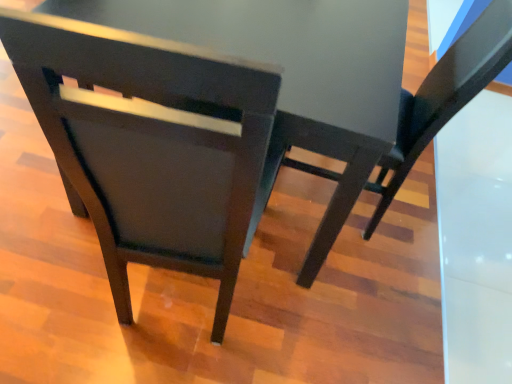
Question: Is matte black chair at center, which is the 2th chair from right to left, to the left or to the right of matte black chair at center, acting as the first chair starting from the right, in the image?

Choices:
 (A) right
 (B) left

Answer: (B)

Question: From the image's perspective, is matte black chair at center, which is the 2th chair from right to left, located above or below matte black chair at center, positioned as the second chair in left-to-right order?

Choices:
 (A) below
 (B) above

Answer: (A)

Question: Considering the positions of matte black chair at center, which is the 2th chair from right to left, and matte black chair at center, acting as the first chair starting from the right, in the image, is matte black chair at center, which is the 2th chair from right to left, taller or shorter than matte black chair at center, acting as the first chair starting from the right,?

Choices:
 (A) short
 (B) tall

Answer: (B)

Question: In the image, is matte black chair at center, acting as the first chair starting from the right, positioned in front of or behind matte black chair at center, which is the 2th chair from right to left?

Choices:
 (A) front
 (B) behind

Answer: (B)

Question: From a real-world perspective, relative to matte black chair at center, which is the 2th chair from right to left, is matte black chair at center, acting as the first chair starting from the right, vertically above or below?

Choices:
 (A) below
 (B) above

Answer: (A)

Question: From the image's perspective, is matte black chair at center, acting as the first chair starting from the right, located above or below matte black chair at center, which is counted as the 1th chair, starting from the left?

Choices:
 (A) above
 (B) below

Answer: (A)

Question: In terms of size, does matte black chair at center, acting as the first chair starting from the right, appear bigger or smaller than matte black chair at center, which is counted as the 1th chair, starting from the left?

Choices:
 (A) big
 (B) small

Answer: (B)